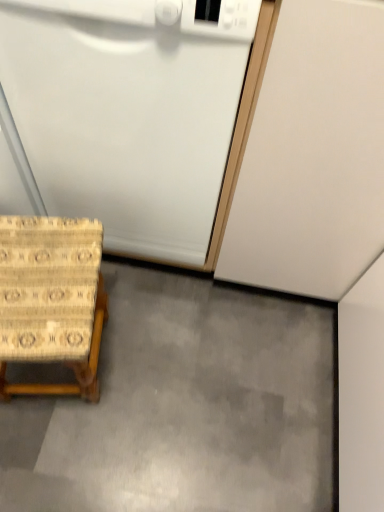
This screenshot has height=512, width=384. Identify the location of vacant region above beige woven stool at lower left (from a real-world perspective). (x=39, y=281).